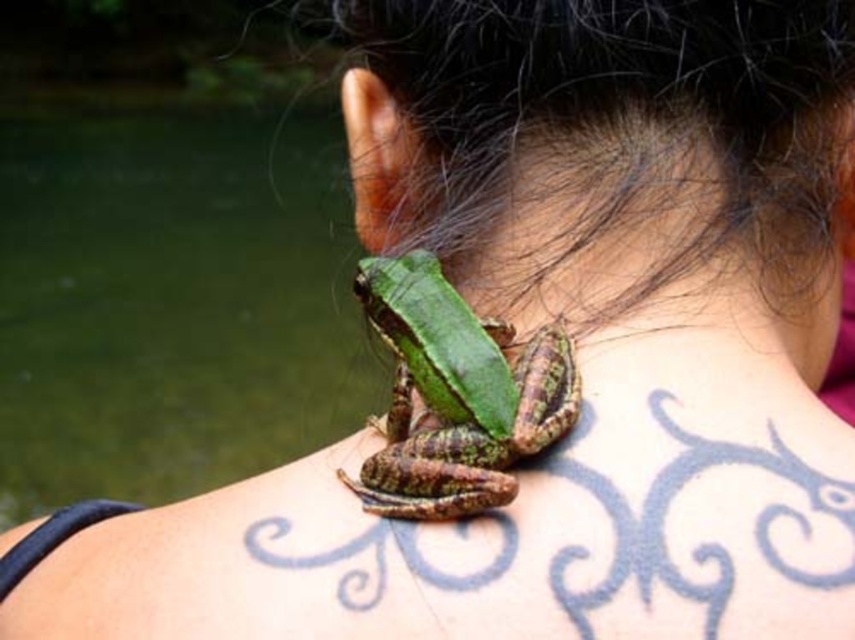
You are a dermatologist examining a patient. You notice two areas of skin on their back. One is labeled as green matte skin at center and the other as green rough skin frog at center. Which of these two areas has a larger surface area?

The green matte skin at center has a larger surface area than the green rough skin frog at center.

You are a photographer trying to capture a detailed shot of the green matte skin at center on the person. Based on the scene, where should you focus your camera to ensure the frog is in the center of the image?

The green matte skin at center is positioned at point (659, 234), so you should focus your camera at those coordinates to center the frog in the image.